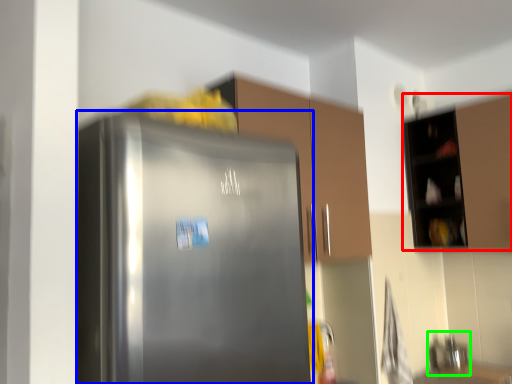
Question: Estimate the real-world distances between objects in this image. Which object is closer to cabinetry (highlighted by a red box), refrigerator (highlighted by a blue box) or sink (highlighted by a green box)?

Choices:
 (A) refrigerator
 (B) sink

Answer: (B)